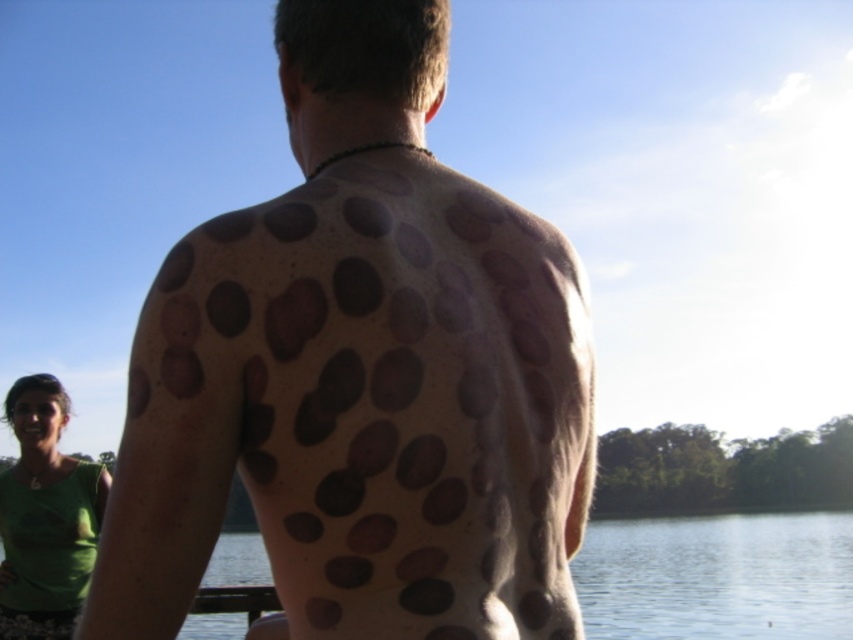
You are a photographer trying to capture a reflection of the transparent water at lower center and the green fabric shirt at lower left in the scene. Which object would have a bigger reflection in the photo?

The transparent water at lower center has a larger size compared to the green fabric shirt at lower left, so its reflection would also be bigger in the photo.

Consider the image. You are a photographer positioned 1.5 meters away from the person with brown textured spots at back. You want to capture a closeup shot of their back without moving closer. Can you do this using a standard zoom lens with a maximum zoom range of 200mm?

The brown textured spots at back are 1.21 meters away from the camera. Since you are positioned 1.5 meters away, the distance is within the standard zoom lens range of 200mm, so yes, you can capture a closeup shot without moving closer.